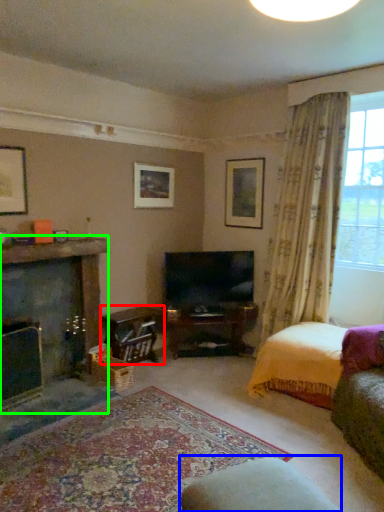
Question: Which object is the farthest from table (highlighted by a red box)? Choose among these: rocking chair (highlighted by a blue box) or fireplace (highlighted by a green box).

Choices:
 (A) rocking chair
 (B) fireplace

Answer: (A)